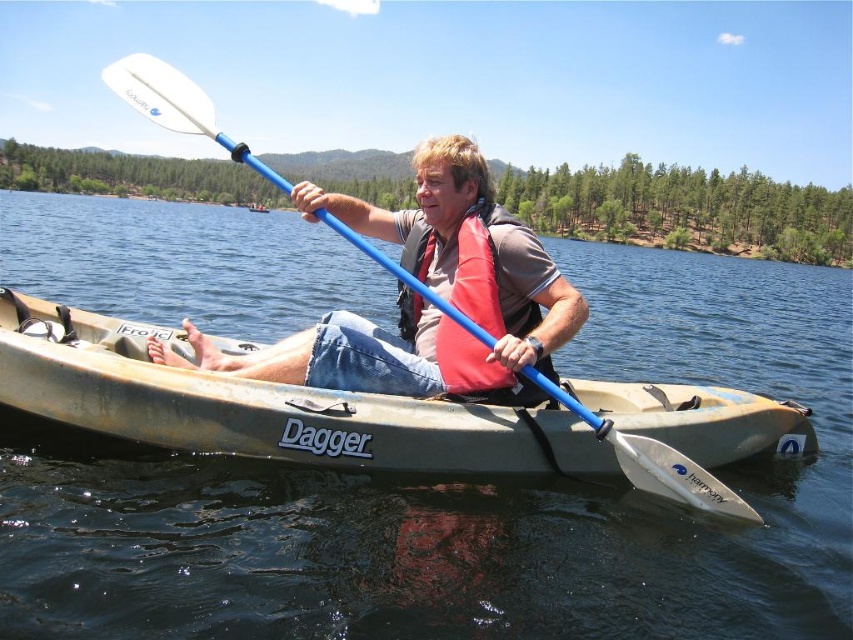
You are a drone operator tasked with capturing aerial footage of the clear blue water at center and the matte blue kayak at center. The drone has a maximum operational range of 30 meters. Can the drone safely capture footage of both objects without exceeding its range?

The distance between the clear blue water at center and the matte blue kayak at center is 35.06 meters, which exceeds the drone operator maximum operational range of 30 meters. Therefore, the drone cannot safely capture footage of both objects without exceeding its range.

You are a drone operator tasked with capturing aerial footage of the scene. The drone needs to hover above the clear blue water at center to get the best shot. Given the coordinates provided, can you confirm if the point at (468,502) is indeed over the clear blue water at center?

Yes, the point at (468,502) is indeed over the clear blue water at center as indicated by the coordinates provided.